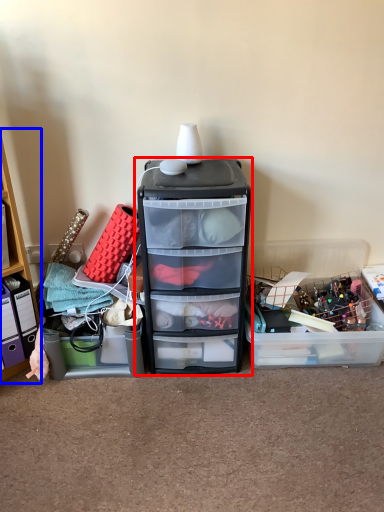
Question: Which point is further to the camera, filing cabinet (highlighted by a red box) or cabinetry (highlighted by a blue box)?

Choices:
 (A) filing cabinet
 (B) cabinetry

Answer: (A)